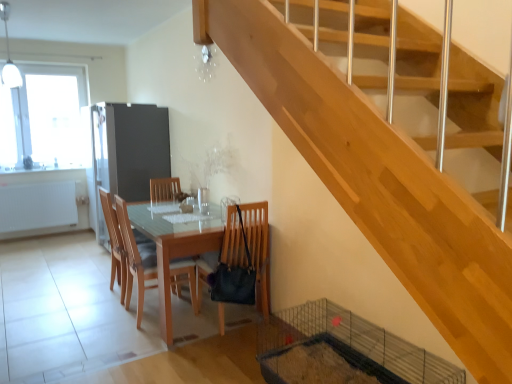
Question: Is matte wooden table at center next to wooden chair at center, the 2th chair in the right-to-left sequence, and touching it?

Choices:
 (A) no
 (B) yes

Answer: (A)

Question: From the image's perspective, does matte wooden table at center appear higher than wooden chair at center, the 2th chair from the left?

Choices:
 (A) no
 (B) yes

Answer: (A)

Question: Could wooden chair at center, the 2th chair in the right-to-left sequence, be considered to be inside matte wooden table at center?

Choices:
 (A) yes
 (B) no

Answer: (A)

Question: Is matte wooden table at center not within wooden chair at center, the 2th chair in the right-to-left sequence?

Choices:
 (A) no
 (B) yes

Answer: (B)

Question: Is matte wooden table at center to the right of wooden chair at center, the 2th chair from the left, from the viewer's perspective?

Choices:
 (A) no
 (B) yes

Answer: (B)

Question: Can you confirm if matte wooden table at center is shorter than wooden chair at center, the 2th chair from the left?

Choices:
 (A) no
 (B) yes

Answer: (B)

Question: Is wooden chair at center, positioned as the 1th chair in right-to-left order, wider than wooden chair at center, placed as the 1th chair when sorted from left to right?

Choices:
 (A) yes
 (B) no

Answer: (A)

Question: Is the depth of wooden chair at center, which ranks as the 3th chair in left-to-right order, less than that of wooden chair at center, which is counted as the third chair, starting from the right?

Choices:
 (A) no
 (B) yes

Answer: (B)

Question: Is the depth of wooden chair at center, which ranks as the 3th chair in left-to-right order, greater than that of wooden chair at center, which is counted as the third chair, starting from the right?

Choices:
 (A) no
 (B) yes

Answer: (A)

Question: Is wooden chair at center, placed as the 1th chair when sorted from left to right, completely or partially inside wooden chair at center, which ranks as the 3th chair in left-to-right order?

Choices:
 (A) yes
 (B) no

Answer: (B)

Question: Does wooden chair at center, which ranks as the 3th chair in left-to-right order, have a greater height compared to wooden chair at center, which is counted as the third chair, starting from the right?

Choices:
 (A) no
 (B) yes

Answer: (A)

Question: From a real-world perspective, is wooden chair at center, which ranks as the 3th chair in left-to-right order, located higher than wooden chair at center, placed as the 1th chair when sorted from left to right?

Choices:
 (A) no
 (B) yes

Answer: (B)

Question: Is wooden chair at center, the 2th chair in the right-to-left sequence, beside matte wooden table at center?

Choices:
 (A) yes
 (B) no

Answer: (B)